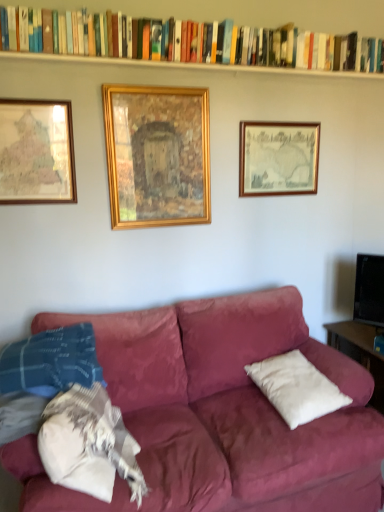
Question: From the image's perspective, is wooden map at left, which ranks as the 3th picture frame in right-to-left order, on white painted wood at upper center?

Choices:
 (A) no
 (B) yes

Answer: (A)

Question: Is wooden map at left, which ranks as the 3th picture frame in right-to-left order, looking in the opposite direction of white painted wood at upper center?

Choices:
 (A) yes
 (B) no

Answer: (B)

Question: Does wooden map at left, placed as the 1th picture frame when sorted from left to right, have a greater width compared to white painted wood at upper center?

Choices:
 (A) yes
 (B) no

Answer: (B)

Question: Is wooden map at left, placed as the 1th picture frame when sorted from left to right, beside white painted wood at upper center?

Choices:
 (A) no
 (B) yes

Answer: (A)

Question: Is wooden map at left, which ranks as the 3th picture frame in right-to-left order, positioned in front of white painted wood at upper center?

Choices:
 (A) yes
 (B) no

Answer: (B)

Question: From a real-world perspective, is wooden map at left, which ranks as the 3th picture frame in right-to-left order, on white painted wood at upper center?

Choices:
 (A) no
 (B) yes

Answer: (A)

Question: From a real-world perspective, is wooden framed map at upper right, the first picture frame in the right-to-left sequence, positioned over gold wooden frame at center, the 2th picture frame from the right, based on gravity?

Choices:
 (A) yes
 (B) no

Answer: (B)

Question: Does wooden framed map at upper right, the first picture frame in the right-to-left sequence, have a lesser width compared to gold wooden frame at center, the 2th picture frame from the left?

Choices:
 (A) yes
 (B) no

Answer: (A)

Question: Considering the relative sizes of wooden framed map at upper right, the third picture frame viewed from the left, and gold wooden frame at center, the 2th picture frame from the right, in the image provided, is wooden framed map at upper right, the third picture frame viewed from the left, taller than gold wooden frame at center, the 2th picture frame from the right,?

Choices:
 (A) no
 (B) yes

Answer: (A)

Question: Is wooden framed map at upper right, the first picture frame in the right-to-left sequence, positioned before gold wooden frame at center, the 2th picture frame from the right?

Choices:
 (A) no
 (B) yes

Answer: (A)

Question: Is gold wooden frame at center, the 2th picture frame from the left, located within wooden framed map at upper right, the third picture frame viewed from the left?

Choices:
 (A) yes
 (B) no

Answer: (B)

Question: From the image's perspective, is wooden framed map at upper right, the first picture frame in the right-to-left sequence, under gold wooden frame at center, the 2th picture frame from the left?

Choices:
 (A) no
 (B) yes

Answer: (A)

Question: Is wooden framed map at upper right, the third picture frame viewed from the left, to the right of white painted wood at upper center from the viewer's perspective?

Choices:
 (A) no
 (B) yes

Answer: (B)